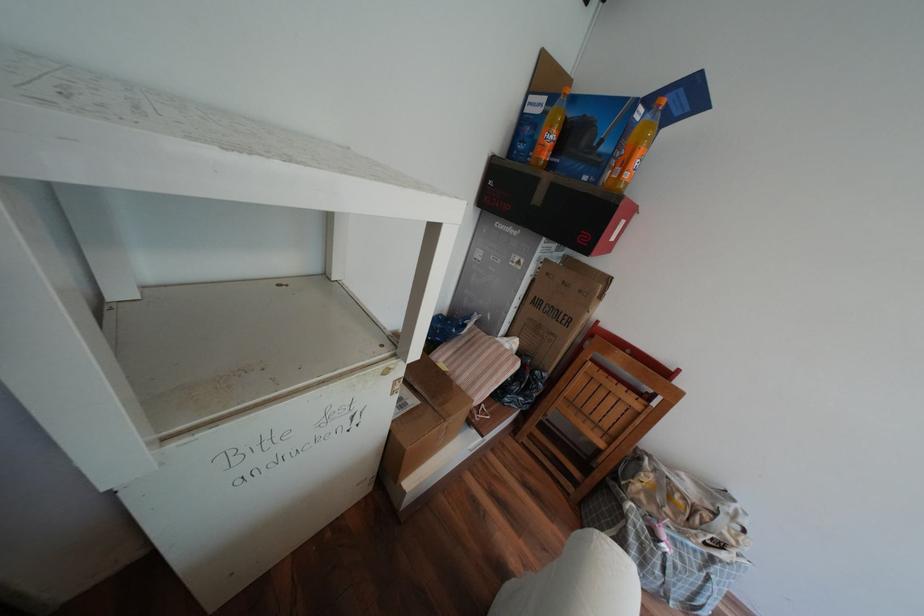
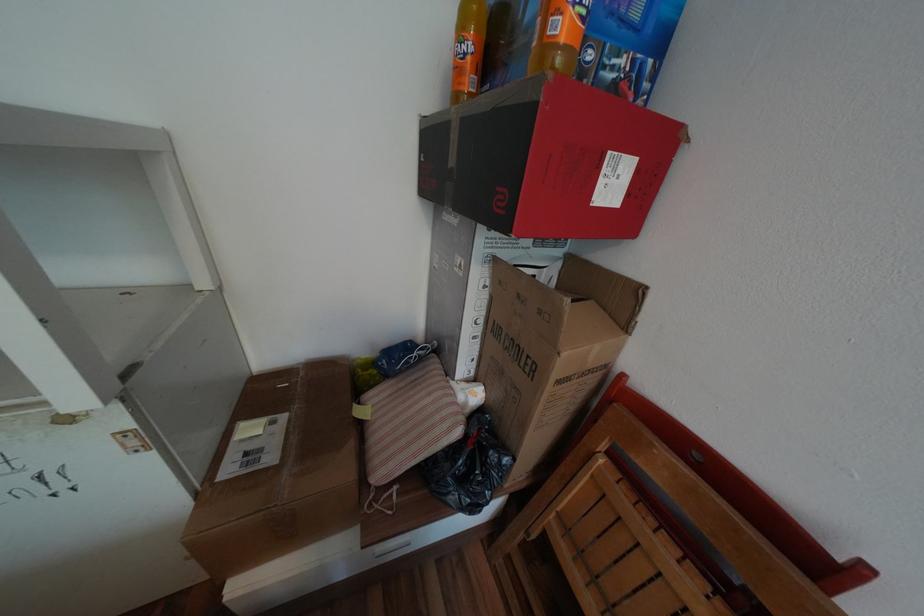
Question: The camera is either moving clockwise (left) or counter-clockwise (right) around the object. The first image is from the beginning of the video and the second image is from the end. Is the camera moving left or right when shooting the video?

Choices:
 (A) Left
 (B) Right

Answer: (B)